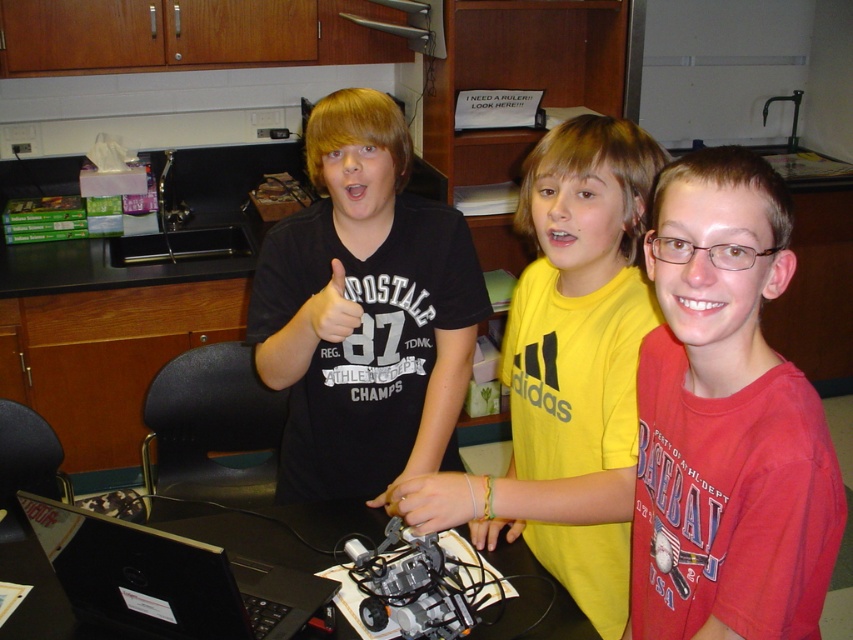
Question: Which object is the closest to the black matte shirt at center?

Choices:
 (A) smooth plastic hand at center
 (B) matte red t-shirt at center

Answer: (A)

Question: Which object is positioned farthest from the black matte shirt at center?

Choices:
 (A) yellow rubber band at lower center
 (B) matte black hand at center
 (C) yellow matte shirt at center
 (D) black matte laptop at lower left

Answer: (D)

Question: Which point is closer to the camera?

Choices:
 (A) (90, 572)
 (B) (316, 317)
 (C) (405, 266)

Answer: (B)

Question: In this image, where is matte red t-shirt at center located relative to smooth skin hand at center?

Choices:
 (A) below
 (B) above

Answer: (B)

Question: Can you confirm if matte red t-shirt at center is positioned below black matte shirt at center?

Choices:
 (A) no
 (B) yes

Answer: (B)

Question: Does black matte laptop at lower left appear on the right side of smooth plastic hand at center?

Choices:
 (A) no
 (B) yes

Answer: (A)